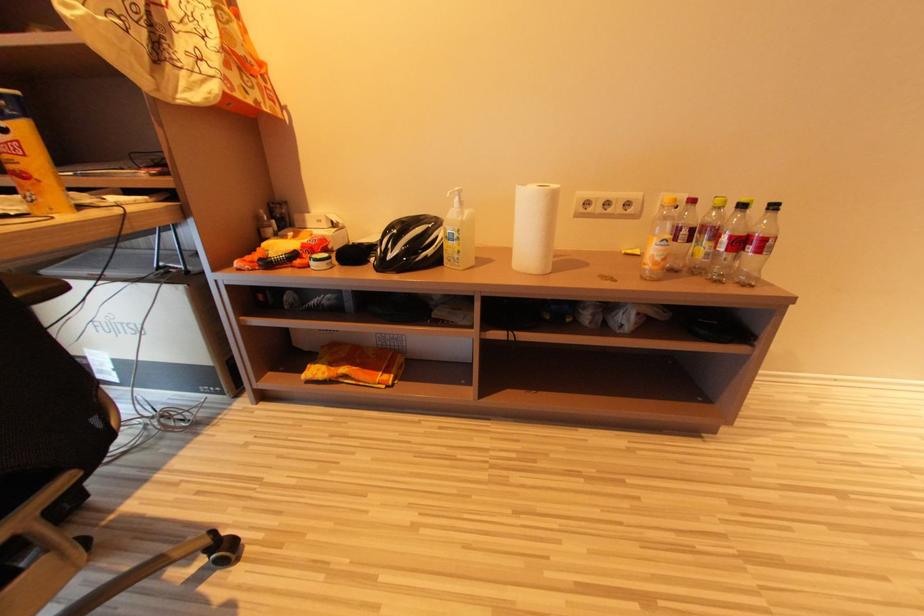
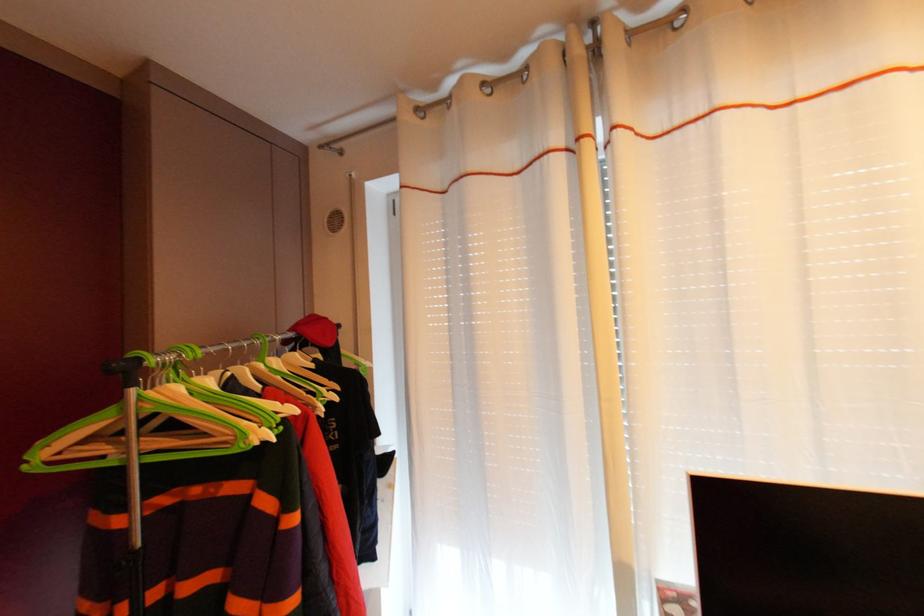
Question: The camera is either moving clockwise (left) or counter-clockwise (right) around the object. The first image is from the beginning of the video and the second image is from the end. Is the camera moving left or right when shooting the video?

Choices:
 (A) Left
 (B) Right

Answer: (B)